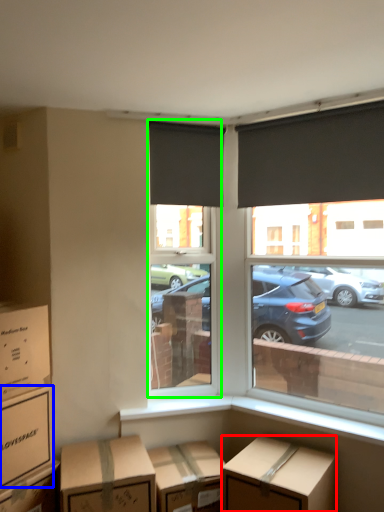
Question: Considering the real-world distances, which object is farthest from box (highlighted by a red box)? box (highlighted by a blue box) or window screen (highlighted by a green box)?

Choices:
 (A) box
 (B) window screen

Answer: (B)